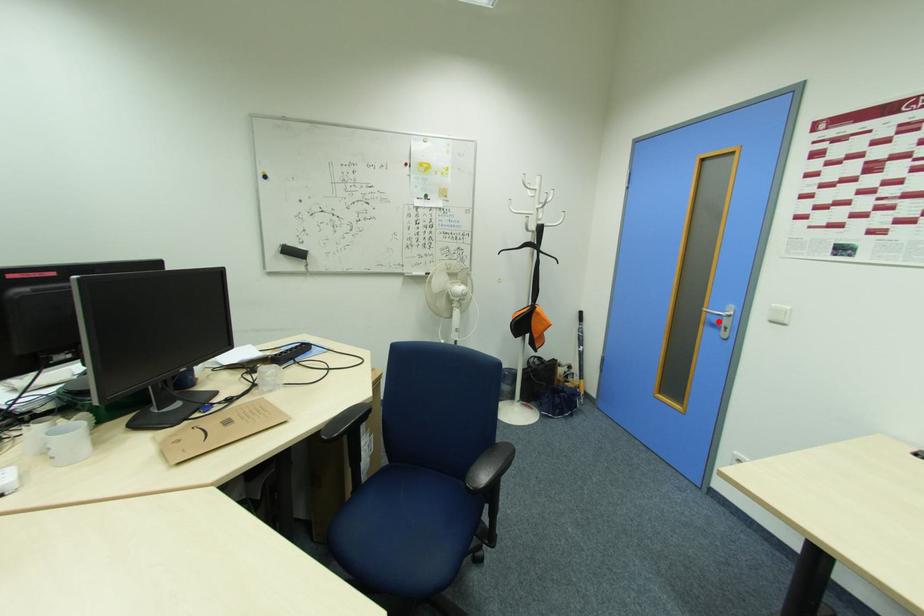
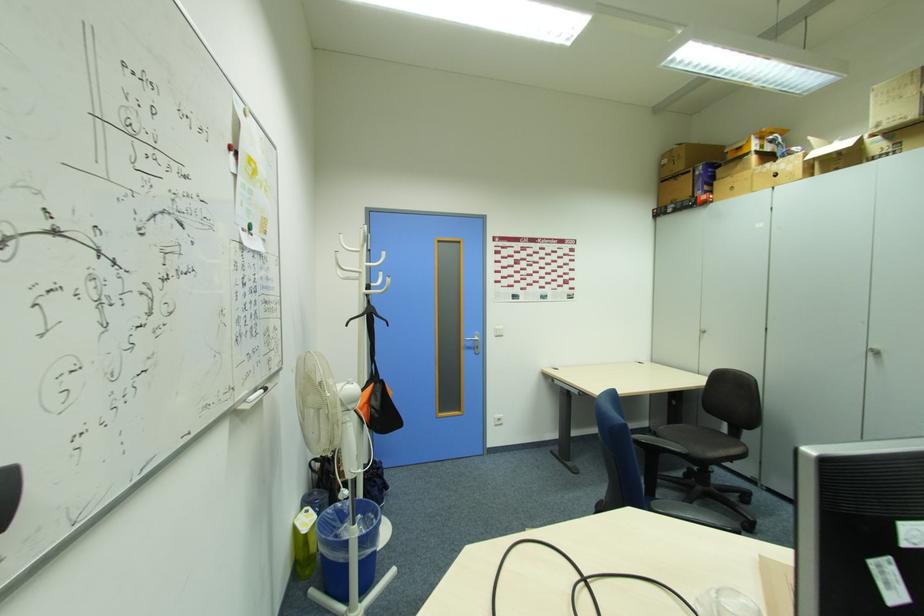
Where in the second image is the point corresponding to the highlighted location from the first image?

(472, 346)